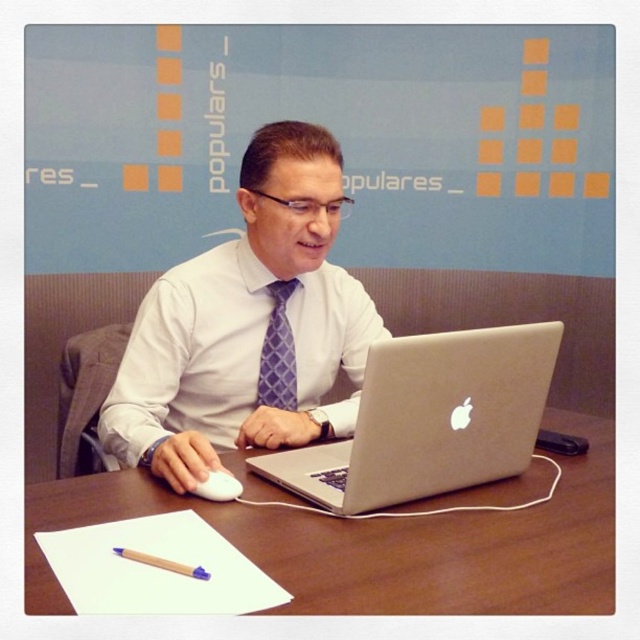
You are a person sitting at the desk in the image. You need to reach for the white matte mouse at lower left. Where exactly should you move your hand to grab it?

The white matte mouse at lower left is located at coordinates point (218, 486), so you should move your hand to that exact position to grab it.

In the scene shown: You are a tailor measuring the width of the purple textured tie at center and the wooden pencil at lower left for a custom order. Which item requires a narrower measurement for the fabric?

The purple textured tie at center requires a narrower measurement for the fabric since it has a lesser width compared to the wooden pencil at lower left.

You are a tailor measuring clothing for a customer. The customer is wearing a white glossy shirt at center and has a silver metallic laptop at center on the desk. Which item is wider?

The white glossy shirt at center is wider than the silver metallic laptop at center according to the description.